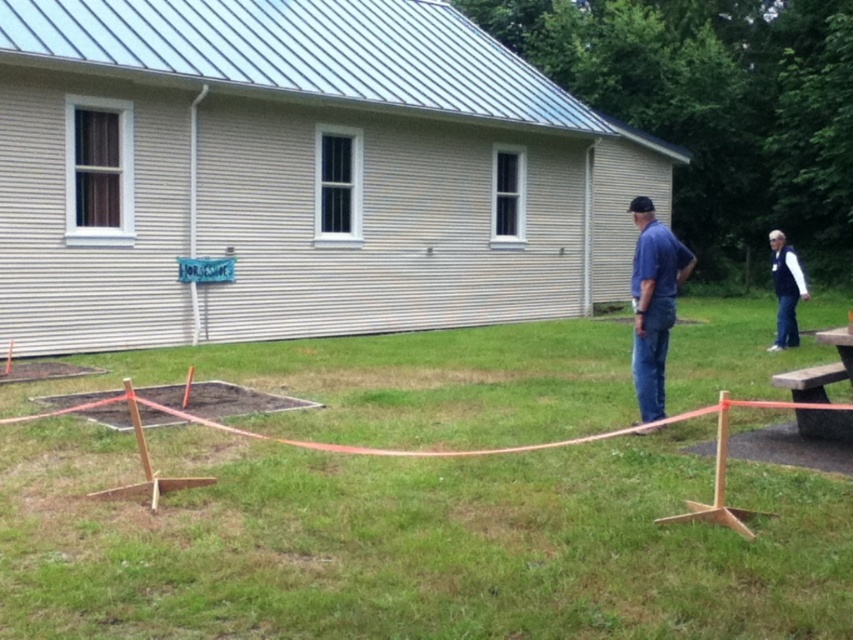
Can you confirm if green grass at center is positioned below blue denim jeans at center?

Indeed, green grass at center is positioned under blue denim jeans at center.

Based on the photo, is green grass at center smaller than blue denim jeans at center?

No.

Is point (309, 604) closer to camera compared to point (635, 209)?

That is True.

Locate an element on the screen. The width and height of the screenshot is (853, 640). green grass at center is located at coordinates (410, 541).

Can you confirm if green grass at center is wider than wooden picnic table at right?

Correct, the width of green grass at center exceeds that of wooden picnic table at right.

Measure the distance between point (820, 579) and camera.

Point (820, 579) is 3.49 meters from camera.

Is point (204, 349) in front of point (830, 340)?

No, (204, 349) is behind (830, 340).

Locate an element on the screen. green grass at center is located at coordinates (410, 541).

This screenshot has height=640, width=853. I want to click on blue denim jeans at center, so click(653, 304).

Who is shorter, blue denim jeans at center or navy blue jacket at lower right?

blue denim jeans at center is shorter.

Which is in front, point (635, 292) or point (779, 330)?

Point (635, 292) is in front.

This screenshot has height=640, width=853. Find the location of `blue denim jeans at center`. blue denim jeans at center is located at coordinates 653,304.